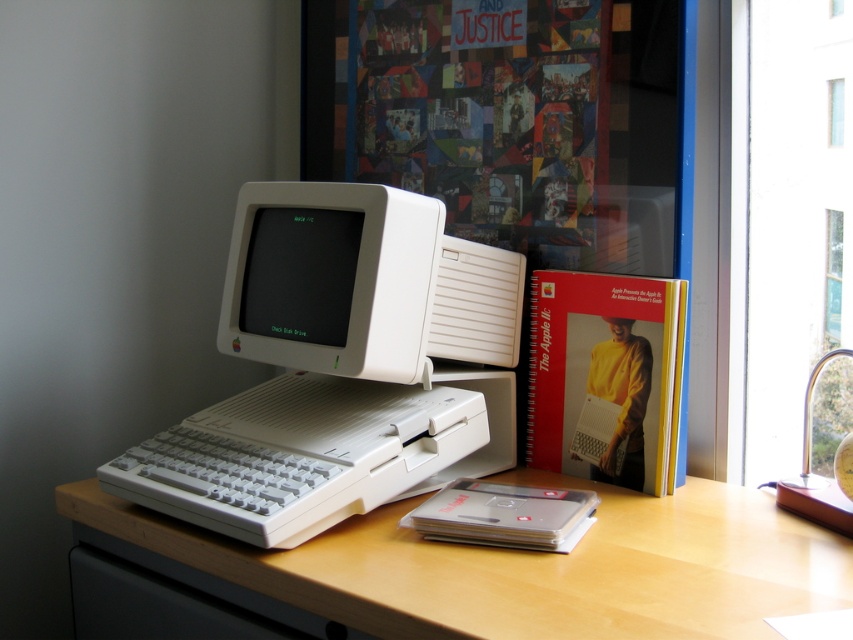
How much distance is there between spiral-bound paper at center and black matte monitor at center?

The distance of spiral-bound paper at center from black matte monitor at center is 14.63 inches.

Is point (660, 314) positioned before point (347, 314)?

No, (660, 314) is further to viewer.

At what (x,y) coordinates should I click in order to perform the action: click on spiral-bound paper at center. Please return your answer as a coordinate pair (x, y). This screenshot has height=640, width=853. Looking at the image, I should click on (606, 376).

Where is `spiral-bound paper at center`? The width and height of the screenshot is (853, 640). spiral-bound paper at center is located at coordinates (606, 376).

Is point (744, 592) in front of point (585, 360)?

Yes, point (744, 592) is closer to viewer.

Can you confirm if white matte computer desk at center is thinner than spiral-bound paper at center?

No, white matte computer desk at center is not thinner than spiral-bound paper at center.

In order to click on white matte computer desk at center in this screenshot , I will do `click(532, 566)`.

Where is `white matte computer desk at center`? white matte computer desk at center is located at coordinates (532, 566).

Can you confirm if white matte computer desk at center is shorter than white plastic monitor at center?

Yes, white matte computer desk at center is shorter than white plastic monitor at center.

Does white matte computer desk at center appear on the right side of white plastic monitor at center?

Indeed, white matte computer desk at center is positioned on the right side of white plastic monitor at center.

Is point (648, 541) more distant than point (337, 371)?

No, (648, 541) is closer to viewer.

You are a GUI agent. You are given a task and a screenshot of the screen. Output one action in this format:
    pyautogui.click(x=<x>, y=<y>)
    Task: Click on the white matte computer desk at center
    This screenshot has height=640, width=853.
    Given the screenshot: What is the action you would take?
    pyautogui.click(x=532, y=566)